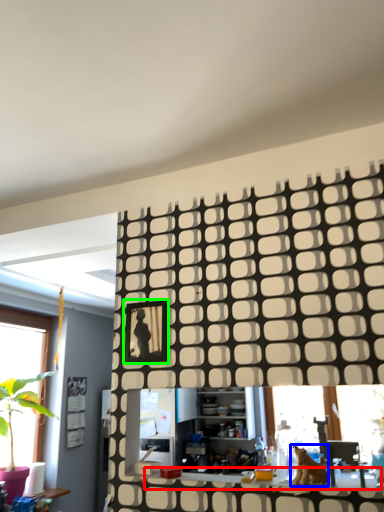
Question: Considering the real-world distances, which object is farthest from counter top (highlighted by a red box)? animal (highlighted by a blue box) or picture frame (highlighted by a green box)?

Choices:
 (A) animal
 (B) picture frame

Answer: (B)